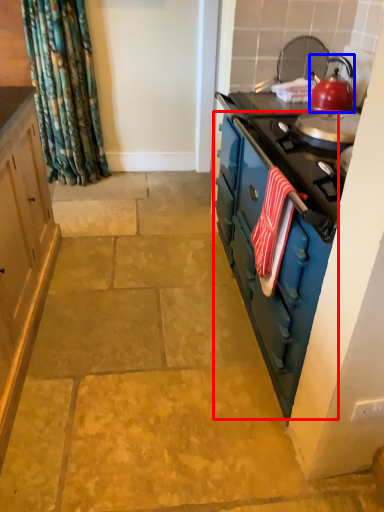
Question: Which point is closer to the camera, dresser (highlighted by a red box) or kitchen appliance (highlighted by a blue box)?

Choices:
 (A) dresser
 (B) kitchen appliance

Answer: (A)